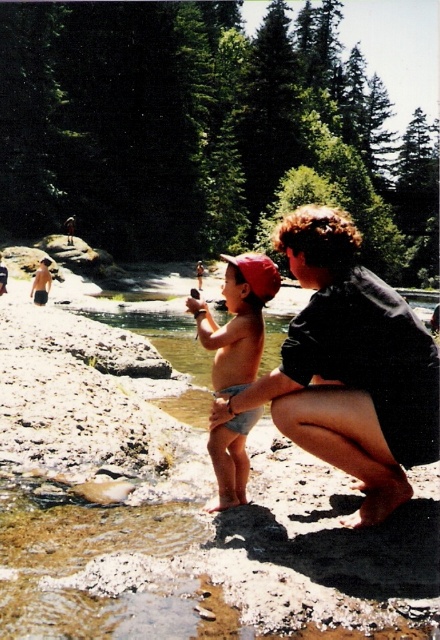
Question: Is dark gray fabric at center positioned in front of tan skin baby at center?

Choices:
 (A) yes
 (B) no

Answer: (A)

Question: Can you confirm if dark gray fabric at center is smaller than tan skin baby at center?

Choices:
 (A) yes
 (B) no

Answer: (B)

Question: Which of the following is the farthest from the observer?

Choices:
 (A) (271, 289)
 (B) (333, 216)

Answer: (A)

Question: Is dark gray fabric at center to the left of tan skin baby at center from the viewer's perspective?

Choices:
 (A) yes
 (B) no

Answer: (B)

Question: Among these objects, which one is farthest from the camera?

Choices:
 (A) dark gray fabric at center
 (B) tan skin baby at center

Answer: (B)